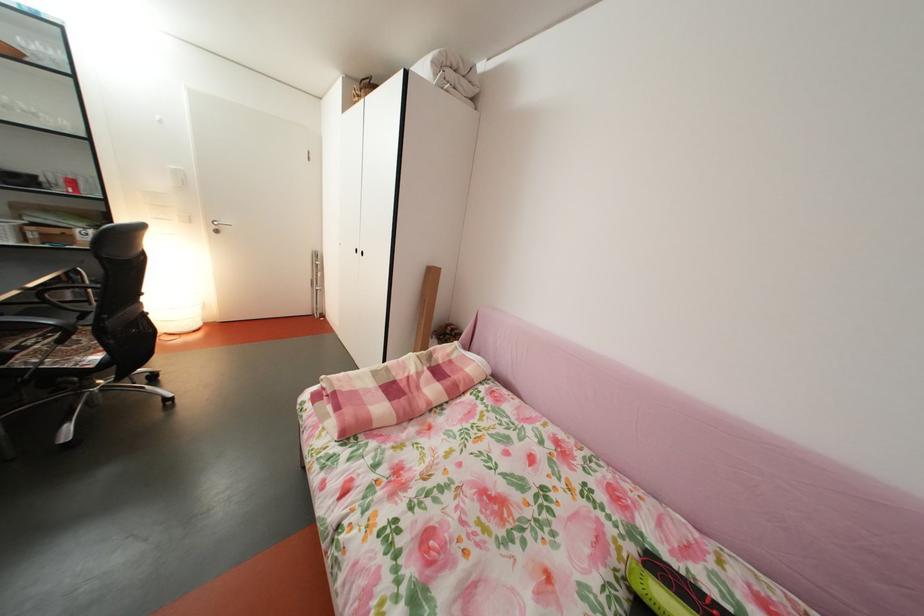
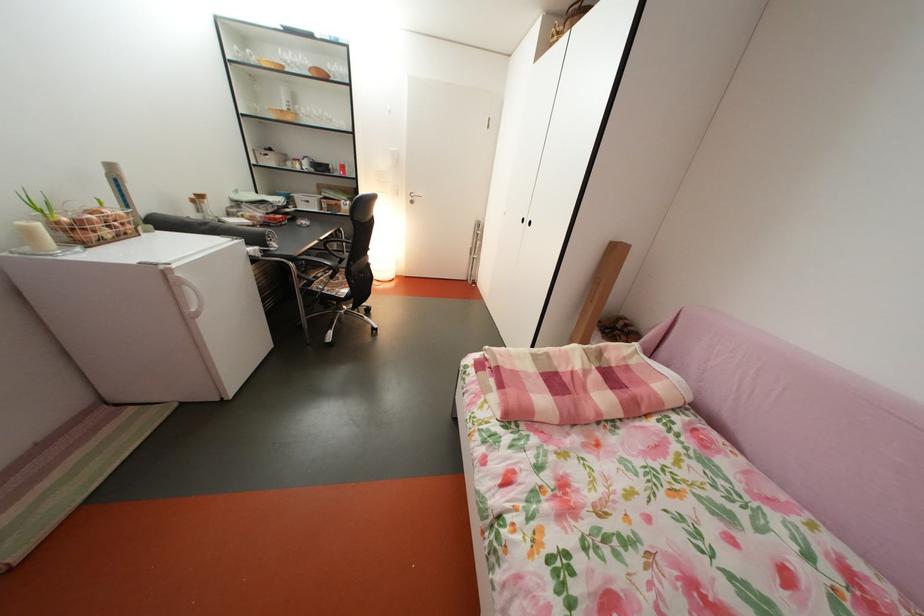
Where in the second image is the point corresponding to pixel 436 375 from the first image?

(604, 374)